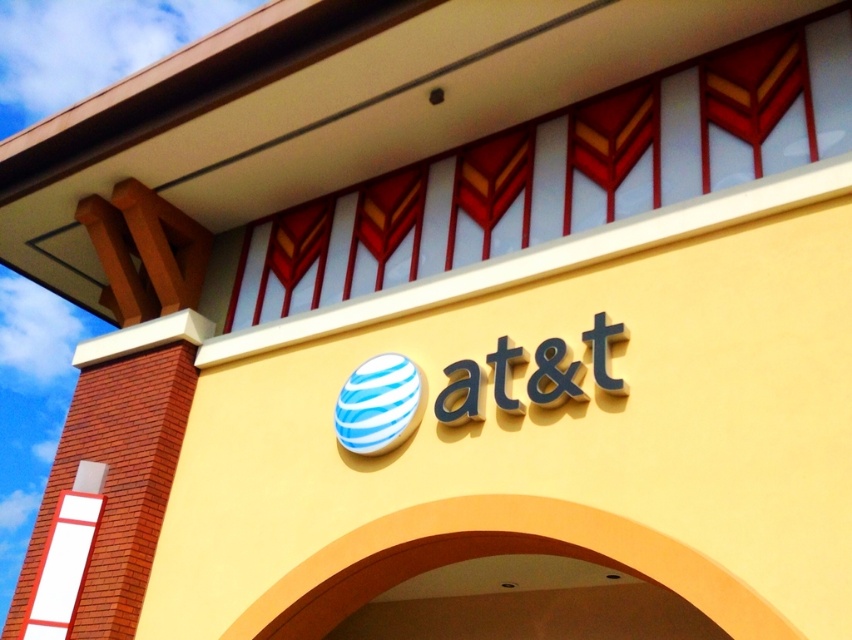
Can you confirm if blue matte sign at center is positioned to the left of blue striped sphere at center?

No, blue matte sign at center is not to the left of blue striped sphere at center.

From the picture: Measure the distance between point [516,410] and camera.

The distance of point [516,410] from camera is 5.79 meters.

At what (x,y) coordinates should I click in order to perform the action: click on blue matte sign at center. Please return your answer as a coordinate pair (x, y). Looking at the image, I should click on (556, 376).